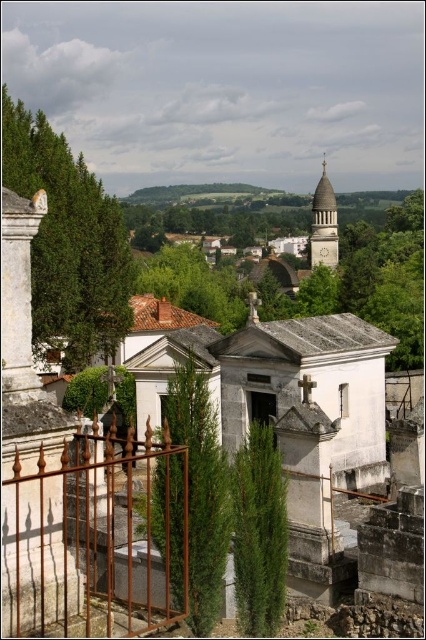
Question: Is green textured stone wall at left further to camera compared to green coniferous tree at center?

Choices:
 (A) yes
 (B) no

Answer: (A)

Question: Does green textured stone at center appear on the right side of green coniferous tree at center?

Choices:
 (A) no
 (B) yes

Answer: (A)

Question: Which object is the farthest from the green leafy tree at center?

Choices:
 (A) rusty iron gate at lower left
 (B) green textured stone at center
 (C) green coniferous tree at center

Answer: (C)

Question: In this image, where is rusty iron gate at lower left located relative to green textured stone wall at left?

Choices:
 (A) above
 (B) below

Answer: (B)

Question: Estimate the real-world distances between objects in this image. Which object is closer to the rusty iron gate at lower left?

Choices:
 (A) green coniferous tree at center
 (B) green textured stone at center
 (C) green textured stone wall at left
 (D) green leafy tree at center

Answer: (B)

Question: Which object is closer to the camera taking this photo?

Choices:
 (A) green coniferous tree at center
 (B) green leafy tree at center
 (C) green textured stone at center

Answer: (C)